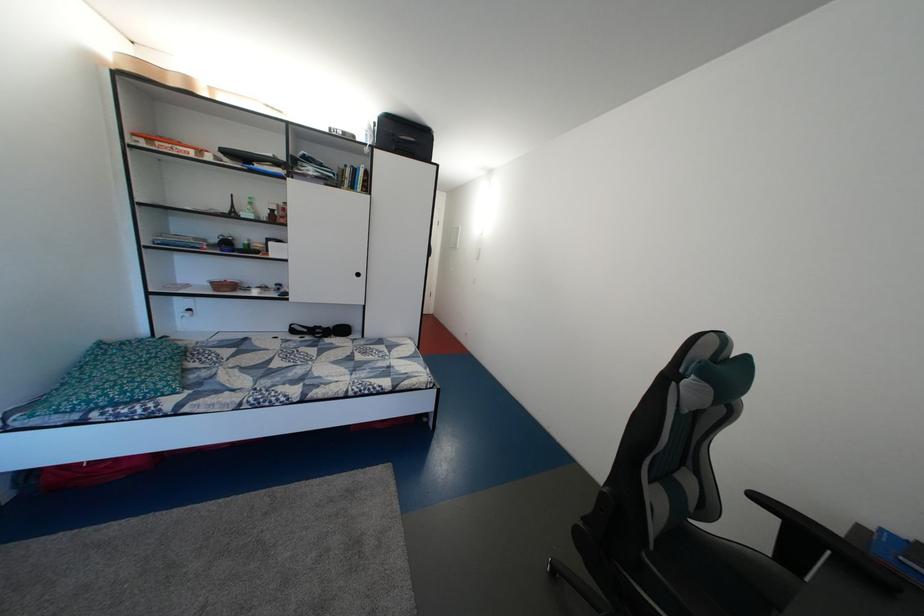
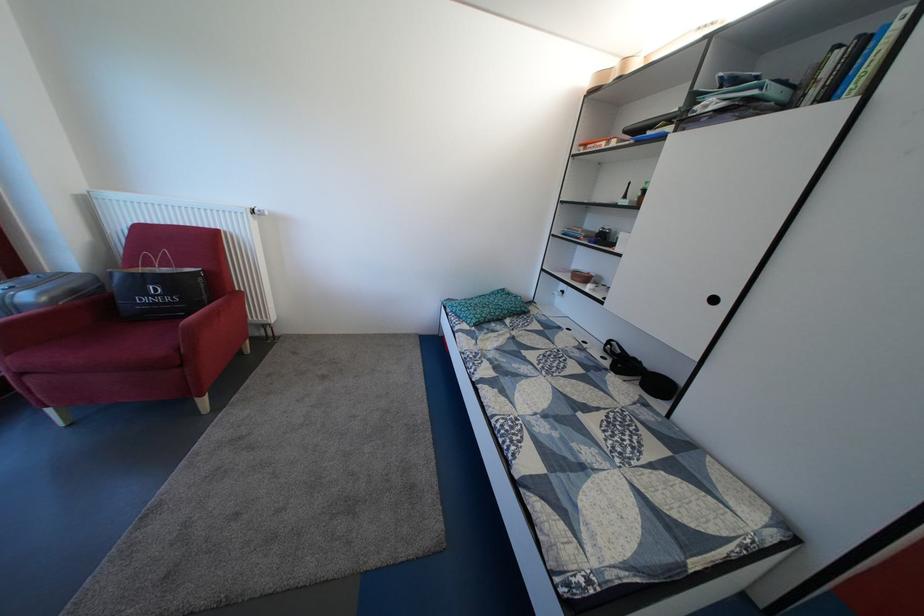
Locate, in the second image, the point that corresponds to point 191,294 in the first image.

(570, 278)